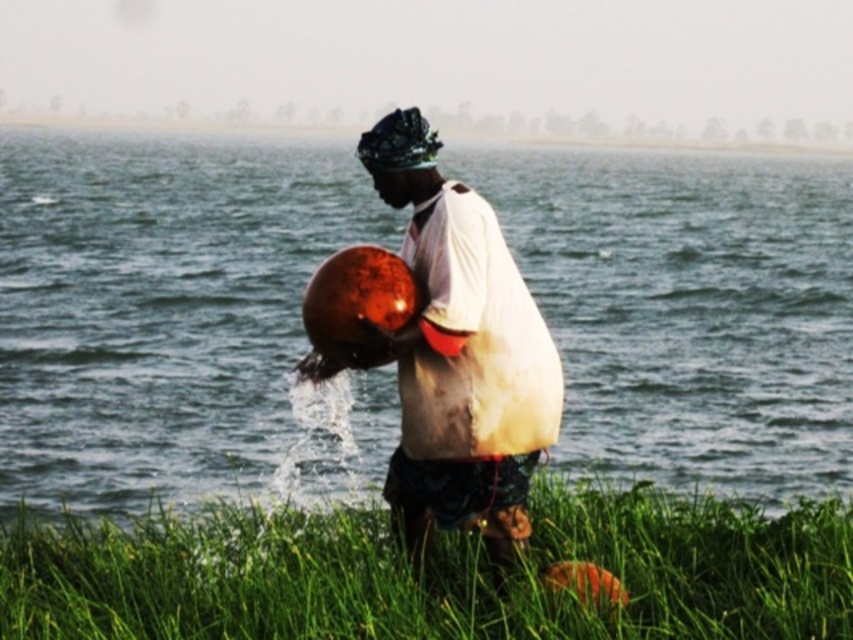
You are a photographer trying to capture the reflection of the glossy metallic water at center and the shiny metallic pot at center in the water below. Which object will have a clearer reflection?

The shiny metallic pot at center will have a clearer reflection because it is located below the glossy metallic water at center, making it closer to the water surface where reflections are more distinct.

You are a photographer trying to capture the scene from above. You need to ensure that both the green grass at lower center and the shiny metallic pot at center are visible in your shot. Based on their positions, which object should you focus on first to frame the shot properly?

The green grass at lower center is located below the shiny metallic pot at center, so you should focus on the shiny metallic pot at center first to ensure it is positioned correctly above the green grass at lower center in the frame.

You are a photographer trying to capture the scene of the person pouring water from the shiny metallic pot at center into the glossy metallic water at center. To ensure the pot and water are both clearly visible in your photo, which object should you focus on first, considering their sizes?

The glossy metallic water at center is larger in size than the shiny metallic pot at center, so you should focus on the glossy metallic water at center first as it is bigger and will be more prominent in the frame.